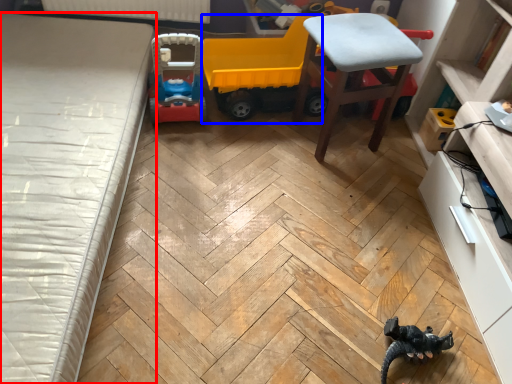
Question: Which object appears farthest to the camera in this image, bed (highlighted by a red box) or model car (highlighted by a blue box)?

Choices:
 (A) bed
 (B) model car

Answer: (B)